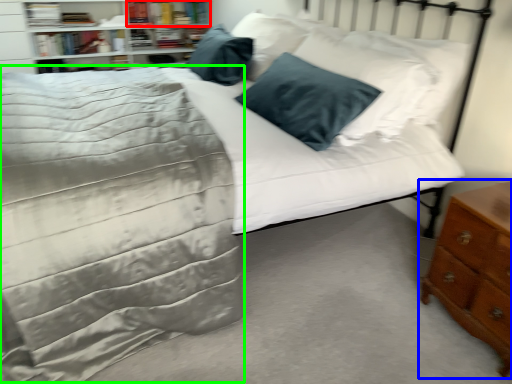
Question: Which object is the farthest from book (highlighted by a red box)? Choose among these: nightstand (highlighted by a blue box) or bedding (highlighted by a green box).

Choices:
 (A) nightstand
 (B) bedding

Answer: (A)